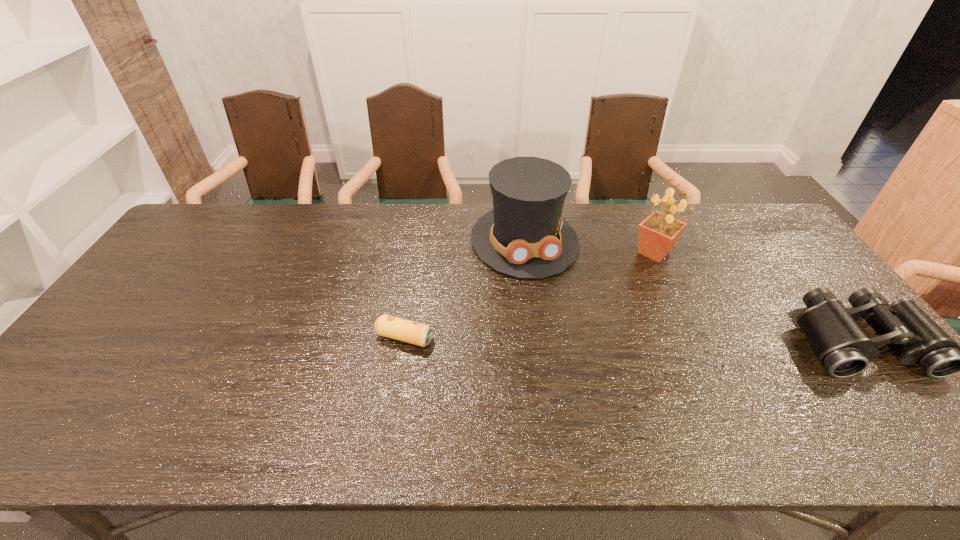
Where is `the leftmost object`? The image size is (960, 540). the leftmost object is located at coordinates (419, 334).

The height and width of the screenshot is (540, 960). I want to click on the shortest object, so click(x=419, y=334).

Locate an element on the screen. This screenshot has height=540, width=960. binoculars is located at coordinates (841, 345).

Where is `the rightmost object`? the rightmost object is located at coordinates (841, 345).

I want to click on dress hat, so click(524, 236).

The image size is (960, 540). I want to click on the third object from left to right, so click(658, 233).

In order to click on free location located on the back of the beer can in this screenshot , I will do `click(415, 274)`.

Identify the location of vacant space located on the front-facing side of the binoculars. This screenshot has height=540, width=960. (906, 401).

Locate an element on the screen. This screenshot has width=960, height=540. vacant space located with goggles on the front of the dress hat is located at coordinates (589, 394).

In order to click on vacant space located 0.090m with goggles on the front of the dress hat in this screenshot , I will do `click(549, 301)`.